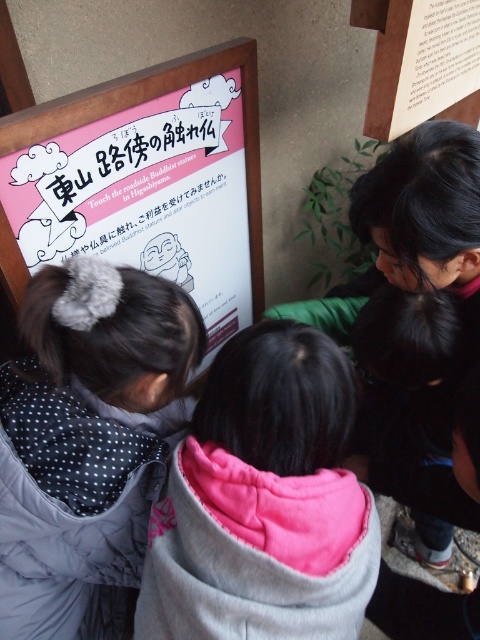
Question: Which point is closer to the camera taking this photo?

Choices:
 (A) (348, 552)
 (B) (36, 374)
 (C) (177, 232)

Answer: (A)

Question: Which object is the farthest from the pink paper sign at upper left?

Choices:
 (A) polka dot scarf at left
 (B) pink fleece jacket at center

Answer: (B)

Question: Can you confirm if pink fleece jacket at center is positioned to the left of polka dot scarf at left?

Choices:
 (A) yes
 (B) no

Answer: (B)

Question: Is polka dot scarf at left positioned behind pink paper sign at upper left?

Choices:
 (A) yes
 (B) no

Answer: (B)

Question: Among these points, which one is farthest from the camera?

Choices:
 (A) (99, 412)
 (B) (124, 124)
 (C) (350, 388)

Answer: (B)

Question: Can you confirm if polka dot scarf at left is positioned above pink paper sign at upper left?

Choices:
 (A) no
 (B) yes

Answer: (A)